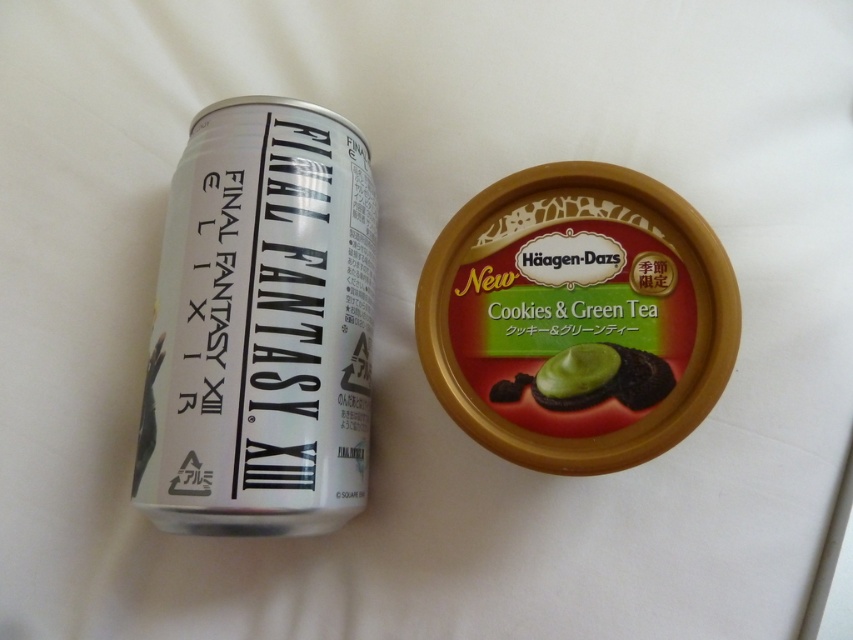
Question: Is green matte ice cream container at center positioned behind green matte chocolate cookie at center?

Choices:
 (A) no
 (B) yes

Answer: (A)

Question: Is green matte ice cream container at center to the right of green matte chocolate cookie at center from the viewer's perspective?

Choices:
 (A) no
 (B) yes

Answer: (A)

Question: Among these objects, which one is farthest from the camera?

Choices:
 (A) green matte chocolate cookie at center
 (B) green matte ice cream container at center

Answer: (A)

Question: Does green matte ice cream container at center have a lesser width compared to green matte chocolate cookie at center?

Choices:
 (A) no
 (B) yes

Answer: (A)

Question: Among these objects, which one is nearest to the camera?

Choices:
 (A) green matte chocolate cookie at center
 (B) green matte ice cream container at center

Answer: (B)